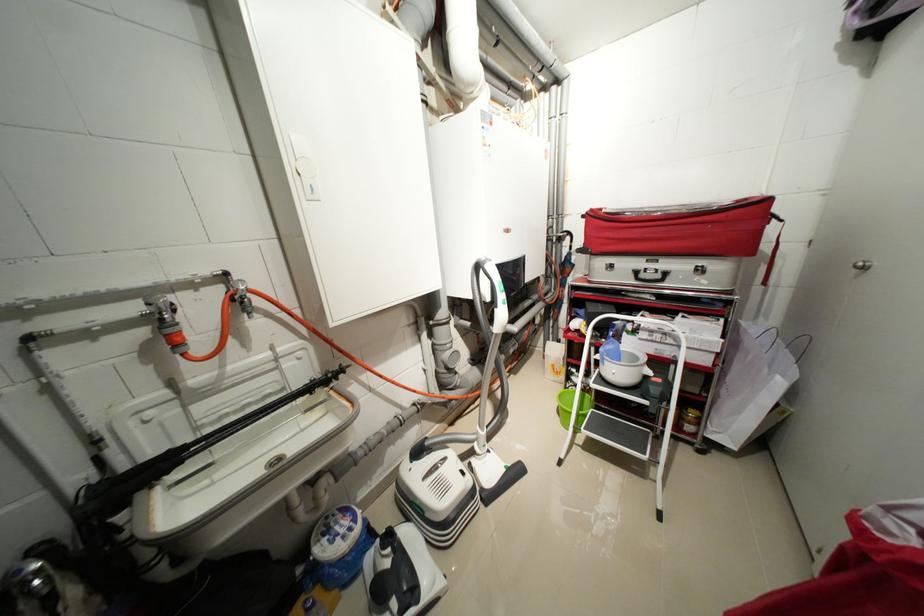
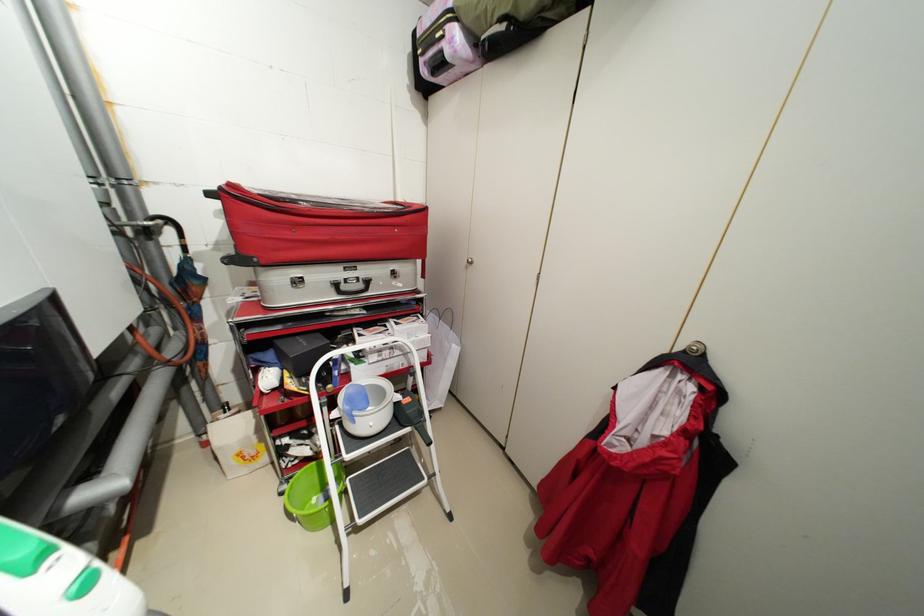
Question: The first image is from the beginning of the video and the second image is from the end. How did the camera likely rotate when shooting the video?

Choices:
 (A) Left
 (B) Right
 (C) Up
 (D) Down

Answer: (B)